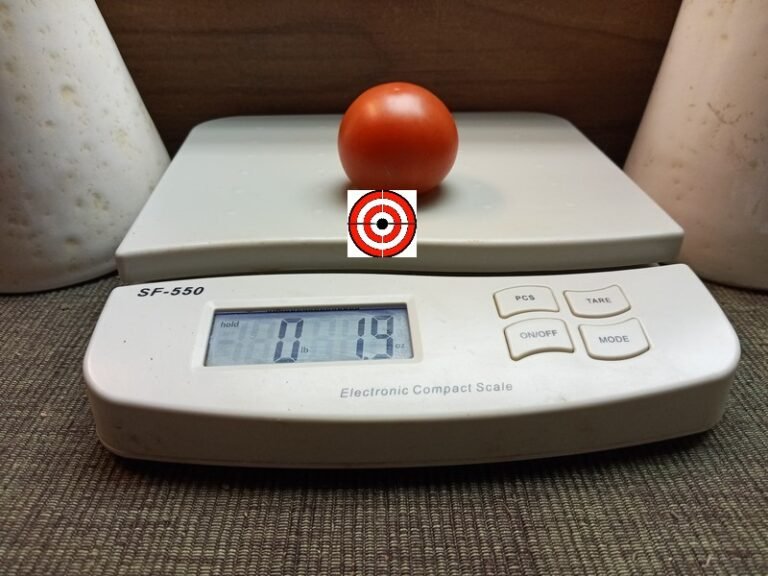
This screenshot has width=768, height=576. I want to click on low profile brown carpet, so click(x=379, y=514).